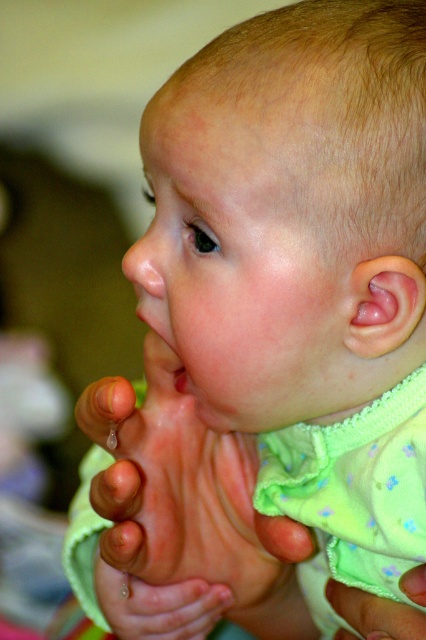
Does pink smooth foot at center have a greater height compared to green fabric hand at lower center?

Indeed, pink smooth foot at center has a greater height compared to green fabric hand at lower center.

Is pink smooth foot at center bigger than green fabric hand at lower center?

Yes.

In order to click on pink smooth foot at center in this screenshot , I will do `click(180, 490)`.